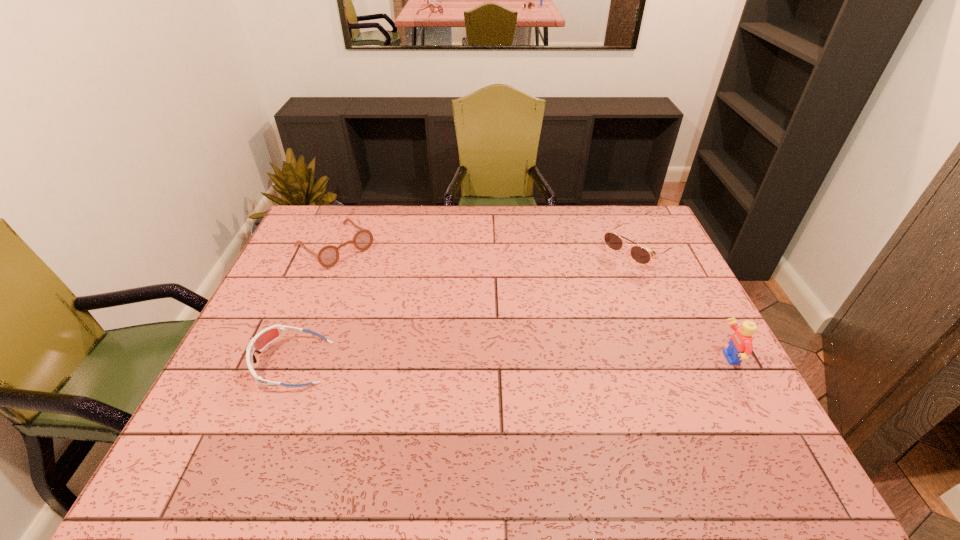
The image size is (960, 540). What are the coordinates of `goggles` in the screenshot? It's located at (258, 343).

Image resolution: width=960 pixels, height=540 pixels. I want to click on the tallest object, so click(740, 346).

Identify the location of spectacles. [x=327, y=256].

In order to click on the second tallest object in this screenshot , I will do `click(639, 254)`.

Identify the location of vacant position located 0.060m on the front-facing side of the goggles. The height and width of the screenshot is (540, 960). (231, 363).

At what (x,y) coordinates should I click in order to perform the action: click on free space located 0.060m on the front-facing side of the goggles. Please return your answer as a coordinate pair (x, y). This screenshot has height=540, width=960. Looking at the image, I should click on (231, 363).

Where is `free region located 0.330m on the face of the tallest object`? This screenshot has width=960, height=540. free region located 0.330m on the face of the tallest object is located at coordinates (588, 359).

The height and width of the screenshot is (540, 960). Find the location of `vacant space located on the face of the tallest object`. vacant space located on the face of the tallest object is located at coordinates (623, 359).

The image size is (960, 540). Identify the location of vacant area located 0.090m on the face of the tallest object. (682, 359).

You are a GUI agent. You are given a task and a screenshot of the screen. Output one action in this format:
    pyautogui.click(x=<x>, y=<y>)
    Task: Click on the vacant space located on the front-facing side of the spectacles
    
    Given the screenshot: What is the action you would take?
    pyautogui.click(x=370, y=275)